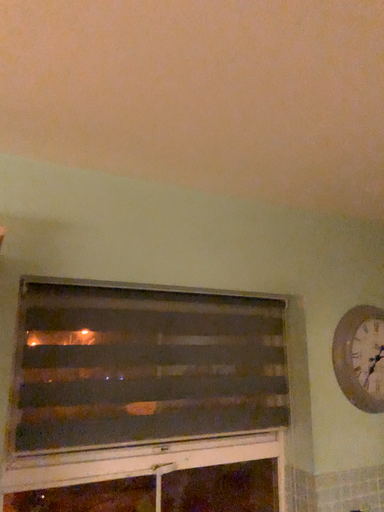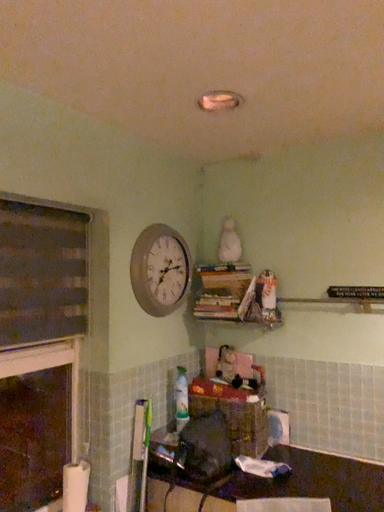
Question: Which way did the camera rotate in the video?

Choices:
 (A) rotated right
 (B) rotated left

Answer: (A)